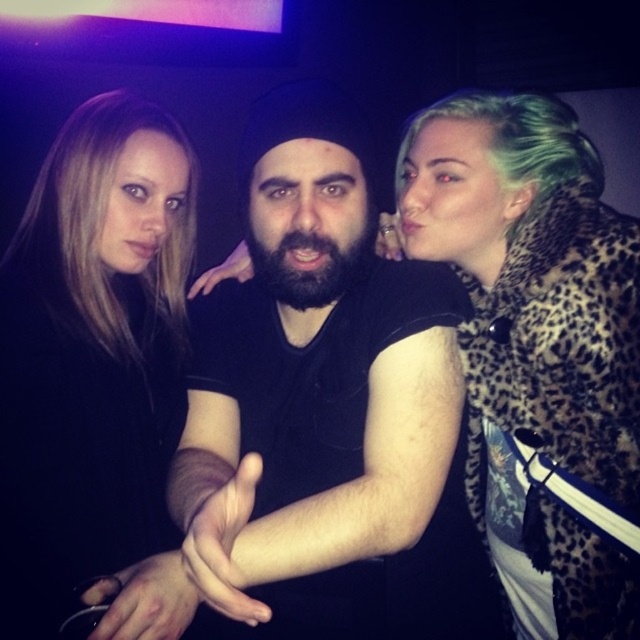
You are standing in front of the group of three people in the image. You notice two points marked in the scene. The first point is at coordinates point (563,250) and the second point is at point (128,496). Which of these two points is nearer to you?

Point (563,250) is closer to the viewer than point (128,496).

You are a photographer at a crowded event and need to adjust the camera focus. The leopard print coat at right is part of a person on the right side of the frame, and the matte black shirt at center is worn by the central figure. How far apart are these two clothing items in centimeters?

The leopard print coat at right and matte black shirt at center are 55.37 centimeters apart.

You are taking a photo of two points in the image. The first point is at coordinates point [355,372] and the second point is at point [611,451]. Which point is closer to your camera?

Point [355,372] is further to the camera than point [611,451], so the second point is closer to the camera.